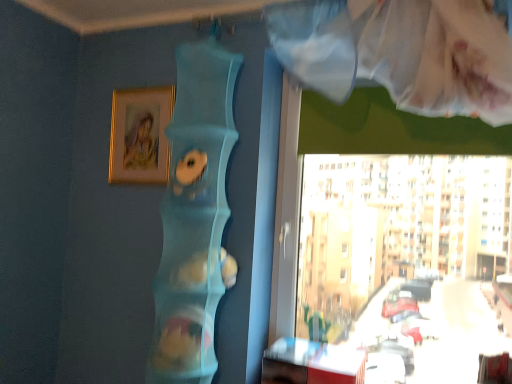
Question: Is gold metallic picture frame at upper left at the back of wooden table at lower right?

Choices:
 (A) yes
 (B) no

Answer: (B)

Question: Considering the relative sizes of wooden table at lower right and gold metallic picture frame at upper left in the image provided, is wooden table at lower right smaller than gold metallic picture frame at upper left?

Choices:
 (A) yes
 (B) no

Answer: (B)

Question: From the image's perspective, is wooden table at lower right under gold metallic picture frame at upper left?

Choices:
 (A) yes
 (B) no

Answer: (A)

Question: Can you confirm if wooden table at lower right is shorter than gold metallic picture frame at upper left?

Choices:
 (A) yes
 (B) no

Answer: (A)

Question: From the image's perspective, is wooden table at lower right above gold metallic picture frame at upper left?

Choices:
 (A) yes
 (B) no

Answer: (B)

Question: Considering the relative positions of wooden table at lower right and gold metallic picture frame at upper left in the image provided, is wooden table at lower right to the right of gold metallic picture frame at upper left from the viewer's perspective?

Choices:
 (A) no
 (B) yes

Answer: (B)

Question: From the image's perspective, is gold metallic picture frame at upper left on wooden table at lower right?

Choices:
 (A) no
 (B) yes

Answer: (B)

Question: From a real-world perspective, is gold metallic picture frame at upper left located beneath wooden table at lower right?

Choices:
 (A) yes
 (B) no

Answer: (B)

Question: Is gold metallic picture frame at upper left wider than wooden table at lower right?

Choices:
 (A) yes
 (B) no

Answer: (B)

Question: Can we say gold metallic picture frame at upper left lies outside wooden table at lower right?

Choices:
 (A) yes
 (B) no

Answer: (A)

Question: Considering the relative positions of gold metallic picture frame at upper left and wooden table at lower right in the image provided, is gold metallic picture frame at upper left to the right of wooden table at lower right from the viewer's perspective?

Choices:
 (A) no
 (B) yes

Answer: (A)

Question: Are gold metallic picture frame at upper left and wooden table at lower right far apart?

Choices:
 (A) no
 (B) yes

Answer: (B)

Question: Considering the positions of point (151, 147) and point (310, 374), is point (151, 147) closer or farther from the camera than point (310, 374)?

Choices:
 (A) closer
 (B) farther

Answer: (B)